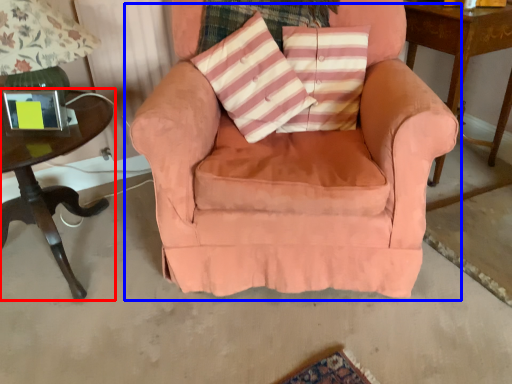
Question: Which object is further to the camera taking this photo, table (highlighted by a red box) or chair (highlighted by a blue box)?

Choices:
 (A) table
 (B) chair

Answer: (A)